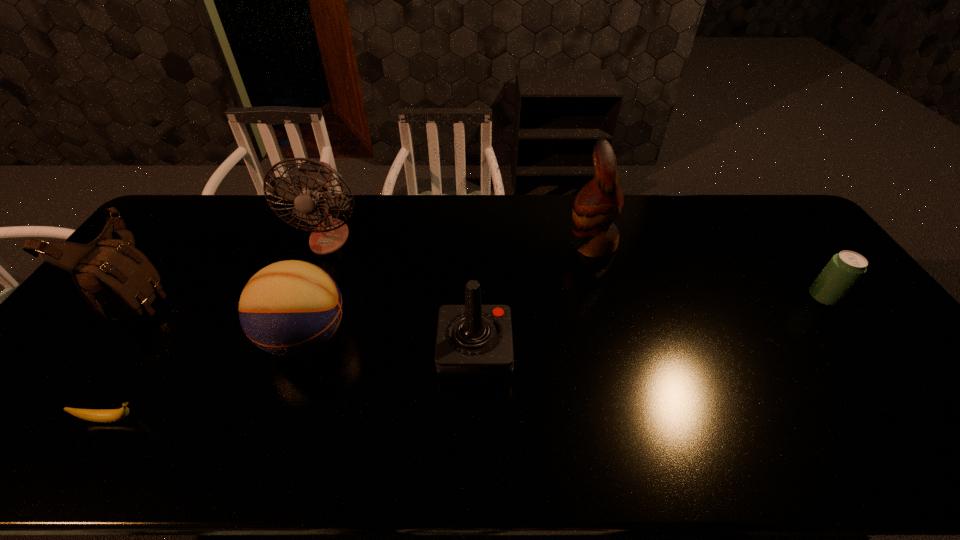
At what (x,y) coordinates should I click in order to perform the action: click on empty location between the second object from right to left and the fan. Please return your answer as a coordinate pair (x, y). This screenshot has height=540, width=960. Looking at the image, I should click on (460, 241).

Find the location of a particular element. This screenshot has height=540, width=960. blank region between the basketball and the sixth tallest object is located at coordinates (564, 317).

Locate an element on the screen. This screenshot has width=960, height=540. blank region between the parrot and the shoulder bag is located at coordinates pyautogui.click(x=367, y=269).

At what (x,y) coordinates should I click in order to perform the action: click on free space between the sixth tallest object and the shoulder bag. Please return your answer as a coordinate pair (x, y). Looking at the image, I should click on (483, 295).

You are a GUI agent. You are given a task and a screenshot of the screen. Output one action in this format:
    pyautogui.click(x=<x>, y=<y>)
    Task: Click on the vacant point located between the shortest object and the shoulder bag
    This screenshot has height=540, width=960.
    Given the screenshot: What is the action you would take?
    pyautogui.click(x=127, y=356)

Where is `object that is the closest to the fan`? object that is the closest to the fan is located at coordinates (289, 308).

Identify the location of the closest object to the fifth object from left to right. This screenshot has width=960, height=540. (289, 308).

Where is `free spot that satisfies the following two spatial constraints: 1. in front of the second shortest object to direct airflow; 2. on the right side of the fan`? The height and width of the screenshot is (540, 960). free spot that satisfies the following two spatial constraints: 1. in front of the second shortest object to direct airflow; 2. on the right side of the fan is located at coordinates (306, 297).